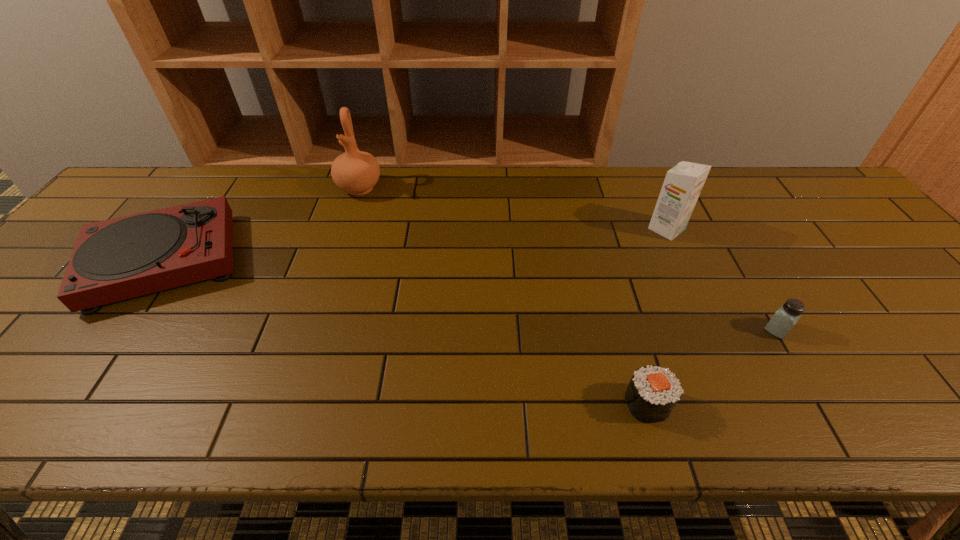
This screenshot has height=540, width=960. In the image, there is a desktop. Identify the location of vacant space at the right edge. (945, 391).

The image size is (960, 540). I want to click on free region at the far left corner of the desktop, so click(165, 176).

The height and width of the screenshot is (540, 960). In the image, there is a desktop. Find the location of `vacant space at the far right corner`. vacant space at the far right corner is located at coordinates (798, 188).

You are a GUI agent. You are given a task and a screenshot of the screen. Output one action in this format:
    pyautogui.click(x=<x>, y=<y>)
    Task: Click on the vacant point located between the sushi and the second object from right to left
    Image resolution: width=960 pixels, height=540 pixels.
    Given the screenshot: What is the action you would take?
    pyautogui.click(x=657, y=316)

I want to click on free space between the third object from left to right and the fourth shortest object, so (657, 316).

The height and width of the screenshot is (540, 960). Find the location of `empty space that is in between the farthest object and the second nearest object`. empty space that is in between the farthest object and the second nearest object is located at coordinates (568, 259).

Where is `free area in between the second tallest object and the saltshaker`? The width and height of the screenshot is (960, 540). free area in between the second tallest object and the saltshaker is located at coordinates (722, 279).

Find the location of `free space between the nearest object and the fourth object from left to right`. free space between the nearest object and the fourth object from left to right is located at coordinates (657, 316).

At what (x,y) coordinates should I click in order to perform the action: click on free spot between the saltshaker and the second tallest object. Please return your answer as a coordinate pair (x, y). The height and width of the screenshot is (540, 960). Looking at the image, I should click on (722, 279).

At what (x,y) coordinates should I click in order to perform the action: click on free space between the pottery and the leftmost object. Please return your answer as a coordinate pair (x, y). Looking at the image, I should click on (262, 224).